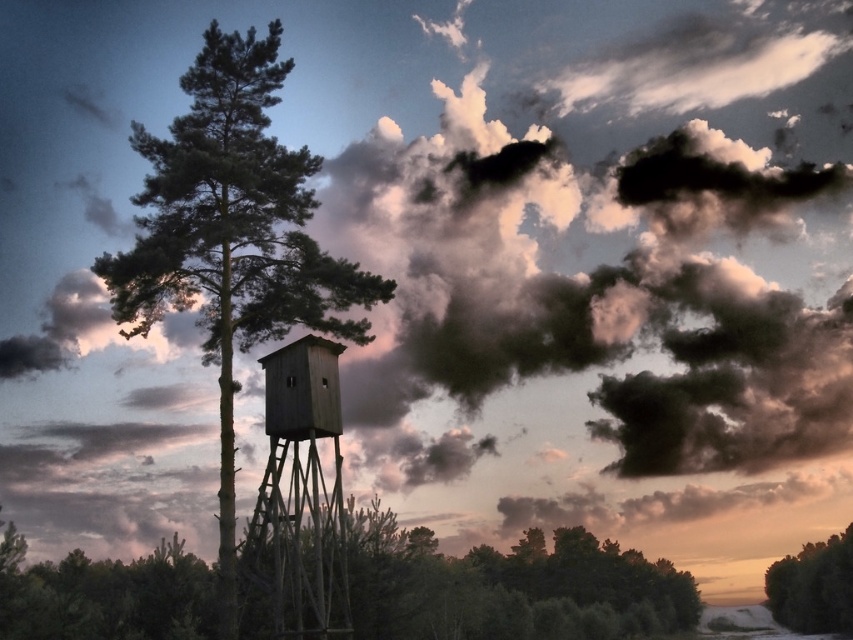
Question: From the image, what is the correct spatial relationship of smooth bark tree at center in relation to wooden tower at center?

Choices:
 (A) above
 (B) below

Answer: (B)

Question: Which of these objects is positioned farthest from the smooth bark tree at center?

Choices:
 (A) wooden tower at center
 (B) green matte tree at center

Answer: (B)

Question: Considering the relative positions of smooth bark tree at center and wooden tower at center in the image provided, where is smooth bark tree at center located with respect to wooden tower at center?

Choices:
 (A) left
 (B) right

Answer: (B)

Question: Which point is farther to the camera?

Choices:
 (A) (424, 534)
 (B) (289, 488)
 (C) (851, 525)
 (D) (160, 244)

Answer: (C)

Question: Considering the real-world distances, which object is farthest from the smooth bark tree at center?

Choices:
 (A) green matte tree at center
 (B) green matte tree at lower right
 (C) wooden tower at center

Answer: (B)

Question: Is green matte tree at center below smooth bark tree at center?

Choices:
 (A) no
 (B) yes

Answer: (A)